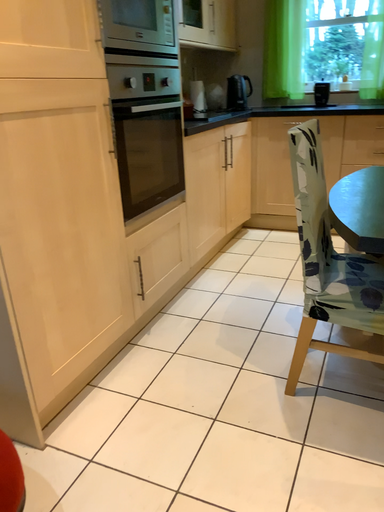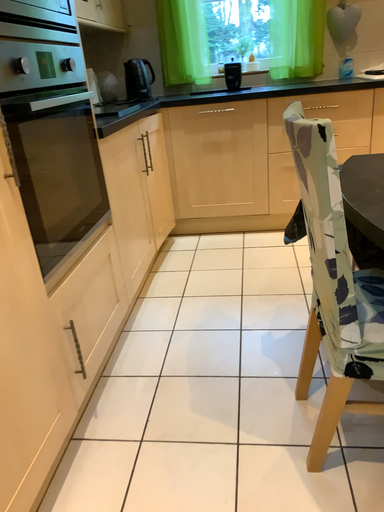
Question: Which way did the camera rotate in the video?

Choices:
 (A) rotated left
 (B) rotated right

Answer: (B)